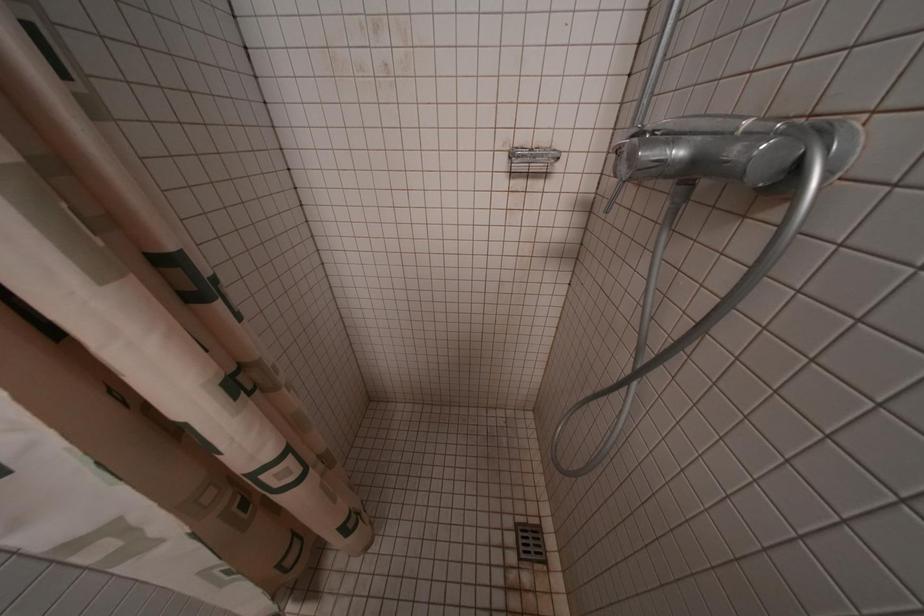
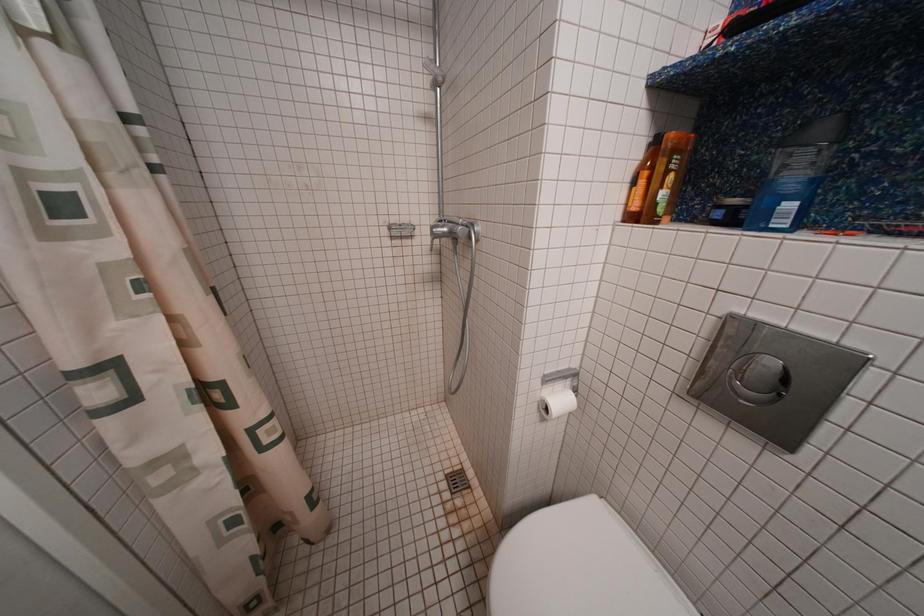
Question: What movement of the cameraman would produce the second image?

Choices:
 (A) Left
 (B) Right
 (C) Forward
 (D) Backward

Answer: (D)